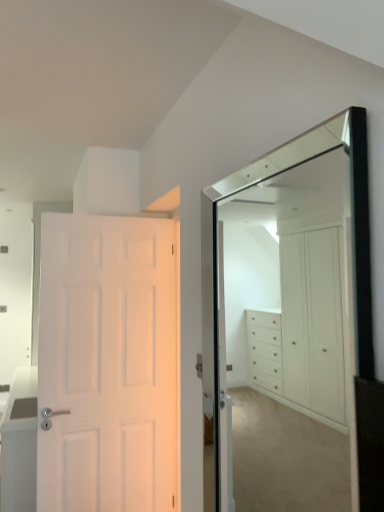
The height and width of the screenshot is (512, 384). I want to click on clear glass mirror at upper right, so click(x=287, y=339).

What is the approximate height of white matte door at left?

white matte door at left is 1.80 meters in height.

The height and width of the screenshot is (512, 384). I want to click on white glossy cabinet at left, so click(20, 443).

Is white matte door at left inside the boundaries of white glossy cabinet at left, or outside?

white matte door at left is outside white glossy cabinet at left.

Based on the photo, from the image's perspective, between white matte door at left and white glossy cabinet at left, who is located below?

white glossy cabinet at left is shown below in the image.

Is white matte door at left next to white glossy cabinet at left?

white matte door at left is not next to white glossy cabinet at left, and they're not touching.

Is white matte door at left wider or thinner than white glossy cabinet at left?

white matte door at left is thinner than white glossy cabinet at left.

From the image's perspective, which one is positioned lower, white glossy cabinet at left or clear glass mirror at upper right?

white glossy cabinet at left, from the image's perspective.

Is point (33, 462) closer or farther from the camera than point (348, 470)?

Point (33, 462) is positioned closer to the camera compared to point (348, 470).

How far apart are white glossy cabinet at left and clear glass mirror at upper right?

A distance of 3.16 meters exists between white glossy cabinet at left and clear glass mirror at upper right.

Which object is positioned more to the right, white glossy cabinet at left or clear glass mirror at upper right?

clear glass mirror at upper right.

From the image's perspective, is white matte door at left under clear glass mirror at upper right?

Correct, white matte door at left appears lower than clear glass mirror at upper right in the image.

Can clear glass mirror at upper right be found inside white matte door at left?

Definitely not — clear glass mirror at upper right is not inside white matte door at left.

In the image, is white matte door at left on the left side or the right side of clear glass mirror at upper right?

Based on their positions, white matte door at left is located to the left of clear glass mirror at upper right.

From the picture: From the image's perspective, would you say clear glass mirror at upper right is shown under white matte door at left?

No, from the image's perspective, clear glass mirror at upper right is not below white matte door at left.

Is clear glass mirror at upper right far from white matte door at left?

Indeed, clear glass mirror at upper right is not near white matte door at left.

Is clear glass mirror at upper right behind white matte door at left?

No, clear glass mirror at upper right is in front of white matte door at left.

From a real-world perspective, is clear glass mirror at upper right physically located above or below white matte door at left?

In terms of real-world spatial position, clear glass mirror at upper right is above white matte door at left.

Is white matte door at left at the back of white glossy cabinet at left?

white glossy cabinet at left is not turned away from white matte door at left.

From a real-world perspective, between white glossy cabinet at left and white matte door at left, who is vertically lower?

In real-world perspective, white glossy cabinet at left is lower.

Can you tell me how much white glossy cabinet at left and white matte door at left differ in facing direction?

They differ by 94.3 degrees in their facing directions.

Does white glossy cabinet at left have a lesser height compared to white matte door at left?

Correct, white glossy cabinet at left is not as tall as white matte door at left.

Can you confirm if clear glass mirror at upper right is wider than white glossy cabinet at left?

No.

Does clear glass mirror at upper right lie behind white glossy cabinet at left?

No.

Is white glossy cabinet at left surrounded by clear glass mirror at upper right?

No.

Consider the image. Does clear glass mirror at upper right turn towards white glossy cabinet at left?

No, clear glass mirror at upper right does not turn towards white glossy cabinet at left.

What are the coordinates of `door on the right of white glossy cabinet at left` in the screenshot? It's located at (107, 364).

What are the coordinates of `cabinetry behind the clear glass mirror at upper right` in the screenshot? It's located at (20, 443).

Considering their positions, is white matte door at left positioned further to clear glass mirror at upper right than white glossy cabinet at left?

white glossy cabinet at left is positioned further to the anchor clear glass mirror at upper right.

Estimate the real-world distances between objects in this image. Which object is closer to white glossy cabinet at left, white matte door at left or clear glass mirror at upper right?

Among the two, white matte door at left is located nearer to white glossy cabinet at left.

Based on their spatial positions, is clear glass mirror at upper right or white glossy cabinet at left closer to white matte door at left?

white glossy cabinet at left is positioned closer to the anchor white matte door at left.

From the image, which object appears to be farther from white matte door at left, white glossy cabinet at left or clear glass mirror at upper right?

clear glass mirror at upper right.

From the image, which object appears to be farther from clear glass mirror at upper right, white glossy cabinet at left or white matte door at left?

Based on the image, white glossy cabinet at left appears to be further to clear glass mirror at upper right.

In the scene shown: From the image, which object appears to be nearer to white glossy cabinet at left, clear glass mirror at upper right or white matte door at left?

white matte door at left lies closer to white glossy cabinet at left than the other object.

Image resolution: width=384 pixels, height=512 pixels. What are the coordinates of `door located between clear glass mirror at upper right and white glossy cabinet at left in the depth direction` in the screenshot? It's located at (107, 364).